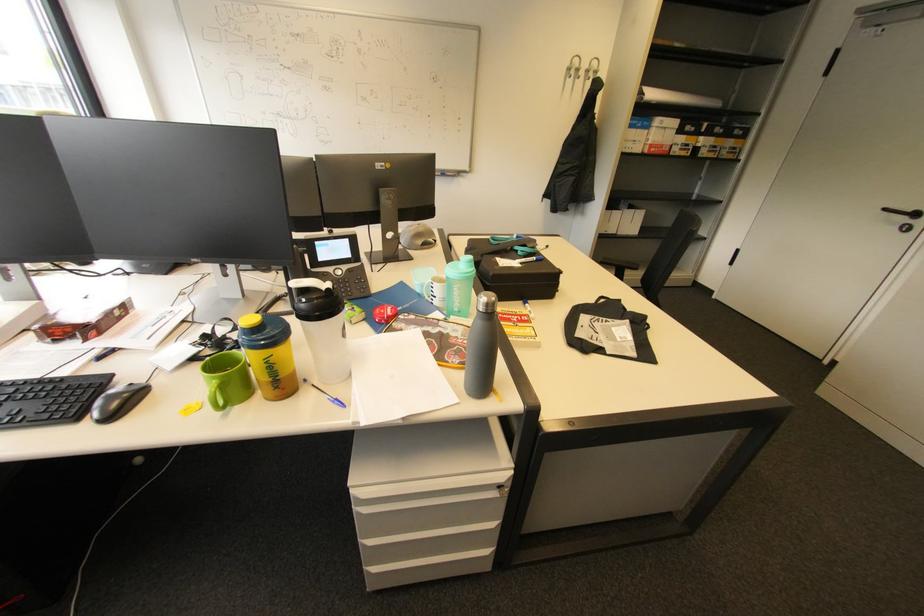
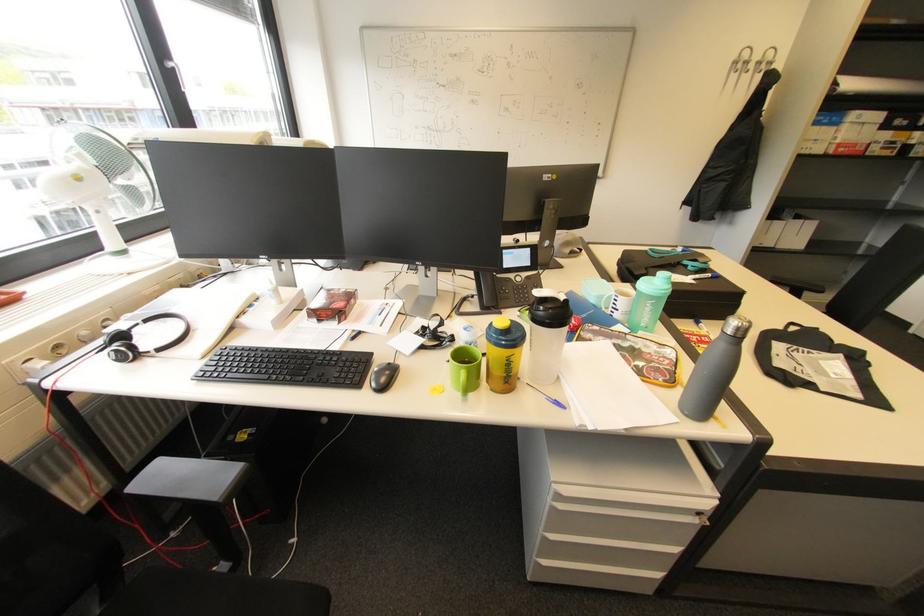
In the second image, find the point that corresponds to [581,62] in the first image.

(751, 54)